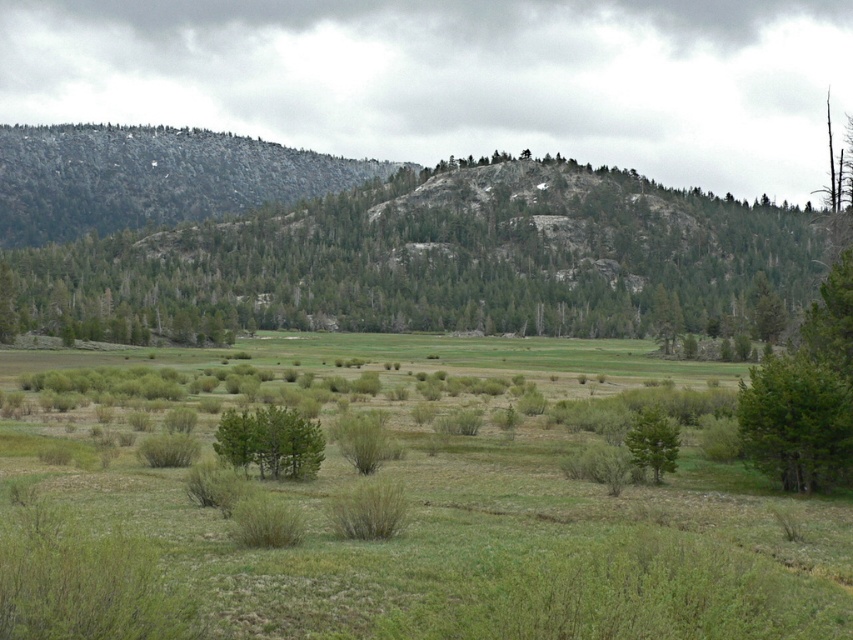
You are standing in a vast open landscape with a grassy field and a distant forest. You want to place a 100 foot long fence between the green matte tree at center and yourself. Is there enough space to fit the fence?

The distance between you and the green matte tree at center is 120.49 feet. Since the fence is 100 feet long, there is sufficient space to place it between you and the green matte tree at center.

You are standing at the origin point in the coordinate system of the image. You want to walk towards the green matte tree at center. Which direction should you move in terms of x and y coordinates?

The green matte tree at center is located at coordinates point (x=270, y=442). Since you are at the origin, you should move in the positive x and positive y direction to reach it.